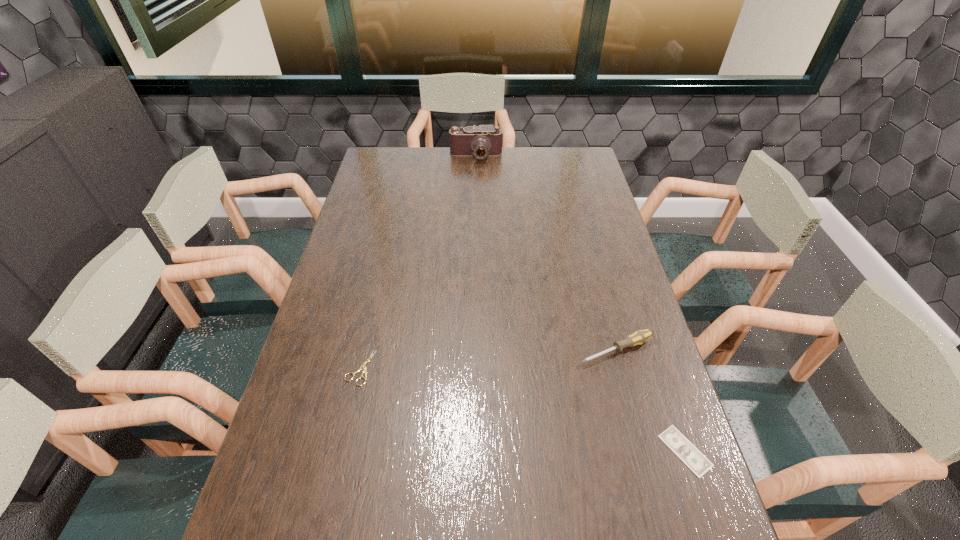
At what (x,y) coordinates should I click in order to perform the action: click on vacant area that lies between the shortest object and the second shortest object. Please return your answer as a coordinate pair (x, y). The image size is (960, 540). Looking at the image, I should click on (522, 409).

At what (x,y) coordinates should I click in order to perform the action: click on vacant area that lies between the money and the leftmost object. Please return your answer as a coordinate pair (x, y). Image resolution: width=960 pixels, height=540 pixels. Looking at the image, I should click on (522, 409).

What are the coordinates of `free space between the second shortest object and the third object from right to left` in the screenshot? It's located at (418, 262).

What are the coordinates of `vacant area that lies between the screwdriver and the shears` in the screenshot? It's located at (488, 359).

Identify the location of vacant space that's between the nearest object and the farthest object. (581, 303).

Locate an element on the screen. object that is the second closest to the third object from right to left is located at coordinates coord(364,370).

This screenshot has height=540, width=960. I want to click on object that can be found as the third closest to the leftmost object, so click(x=481, y=141).

Find the location of a particular element. This screenshot has width=960, height=540. free space that satisfies the following two spatial constraints: 1. on the back side of the leftmost object; 2. on the right side of the camera is located at coordinates (408, 156).

Where is `free space that satisfies the following two spatial constraints: 1. on the front side of the shortest object; 2. on the right side of the second shortest object`? The height and width of the screenshot is (540, 960). free space that satisfies the following two spatial constraints: 1. on the front side of the shortest object; 2. on the right side of the second shortest object is located at coordinates (342, 451).

Find the location of `free region that satisfies the following two spatial constraints: 1. on the back side of the second tallest object; 2. on the right side of the leftmost object`. free region that satisfies the following two spatial constraints: 1. on the back side of the second tallest object; 2. on the right side of the leftmost object is located at coordinates (364, 350).